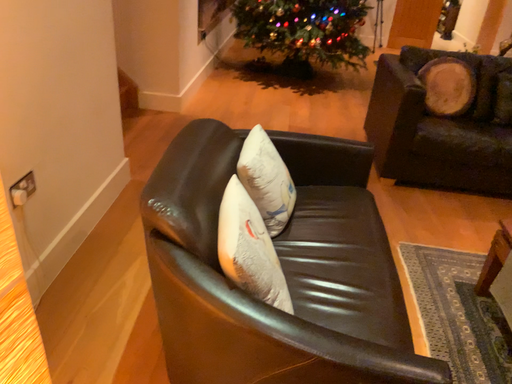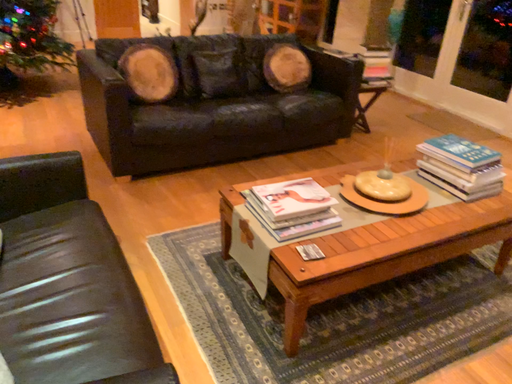
Question: How did the camera likely rotate when shooting the video?

Choices:
 (A) rotated left
 (B) rotated right

Answer: (B)